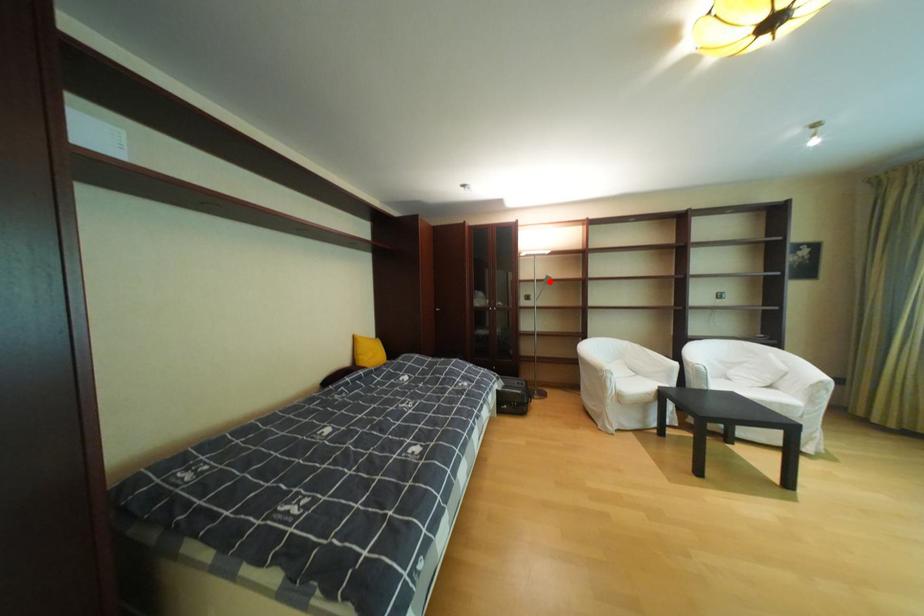
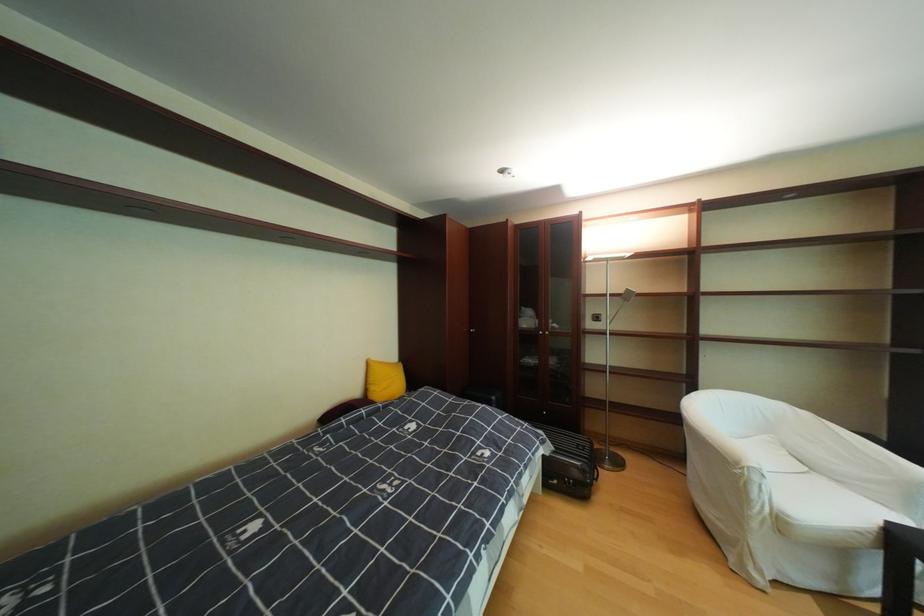
The point at the highlighted location is marked in the first image. Where is the corresponding point in the second image?

(624, 296)